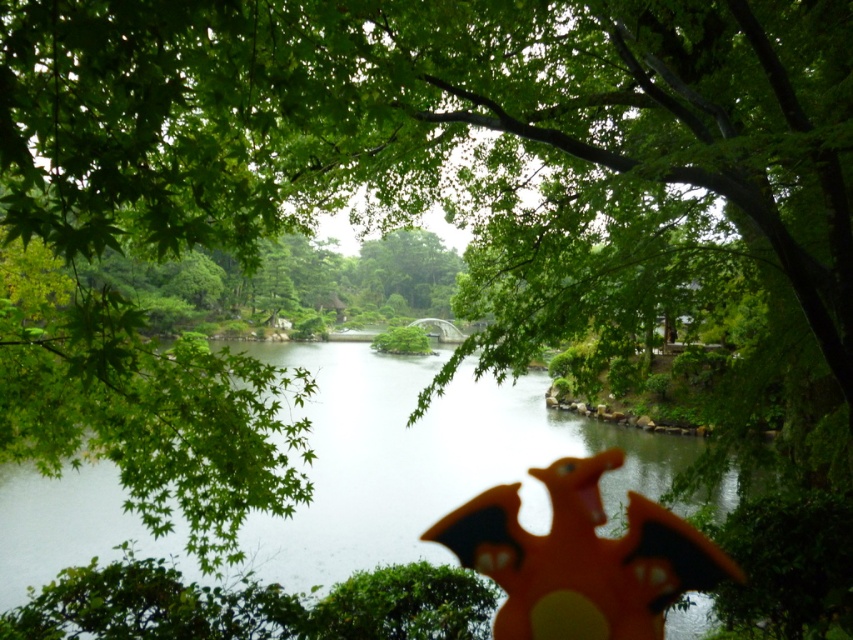
You are a photographer adjusting your camera to focus on the orange matte dragon at center. Since the transparent water at center is in the way, will you need to move the dragon forward or backward to get it in focus?

Since the transparent water at center is closer to the viewer than the orange matte dragon at center, you need to move the orange matte dragon at center forward to bring it closer to the camera and into focus.

You are standing at the point marked by coordinates point [424,458] in the scene. What do you see immediately around you?

The point [424,458] corresponds to transparent water at center, so you are surrounded by calm water reflecting the overcast sky.